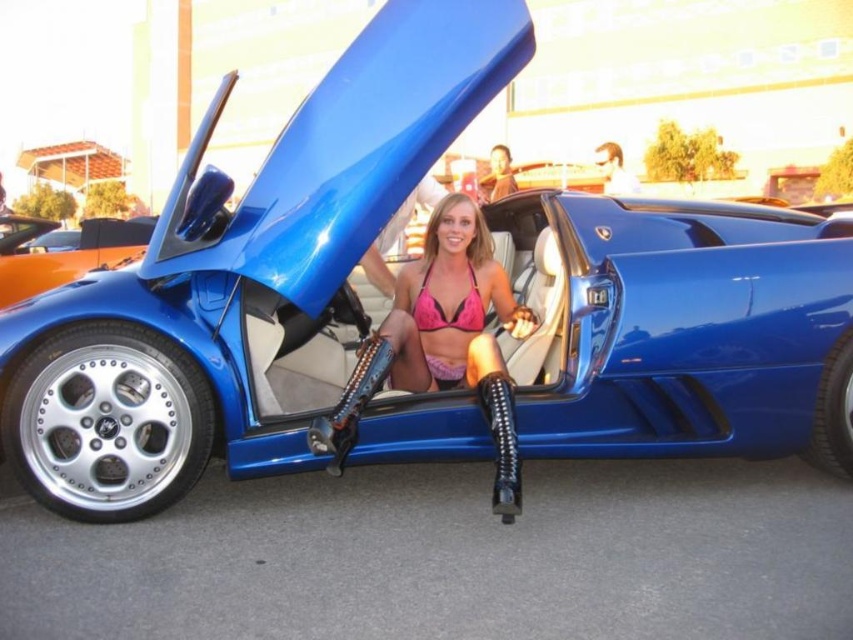
You are a photographer trying to capture the woman in the car. Which of the two pink bikini tops, the pink bikini top at center or the pink matte bikini top at center, is positioned closer to the camera?

The pink bikini top at center is closer to the viewer than the pink matte bikini top at center, so it is the one positioned closer to the camera.